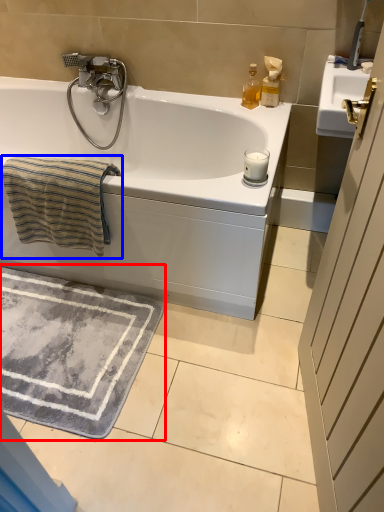
Question: Which object is closer to the camera taking this photo, bath mat (highlighted by a red box) or beach towel (highlighted by a blue box)?

Choices:
 (A) bath mat
 (B) beach towel

Answer: (B)